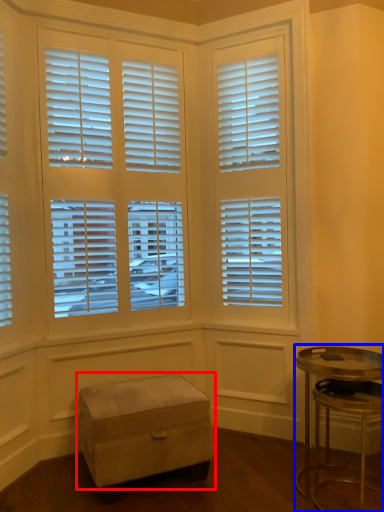
Question: Which point is closer to the camera, step stool (highlighted by a red box) or table (highlighted by a blue box)?

Choices:
 (A) step stool
 (B) table

Answer: (B)